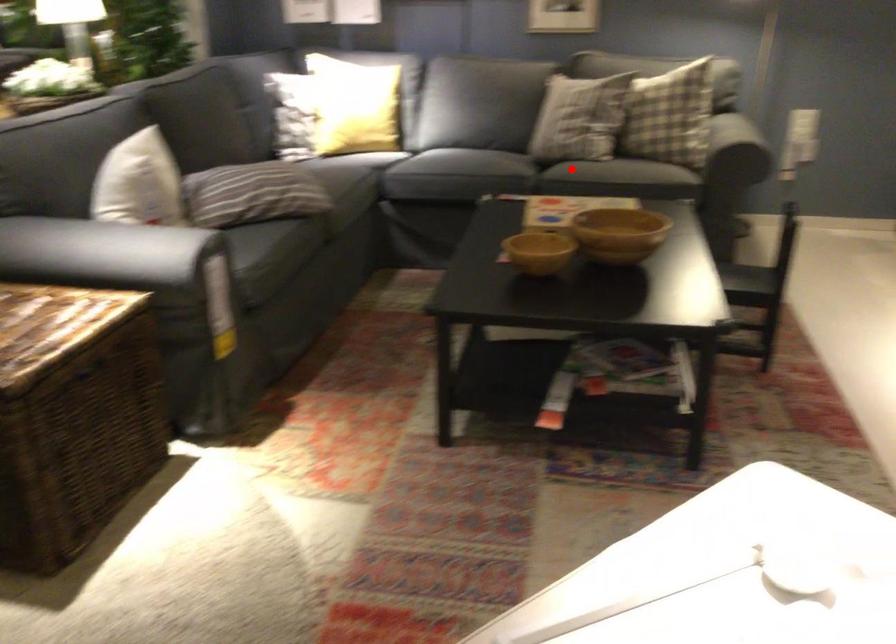
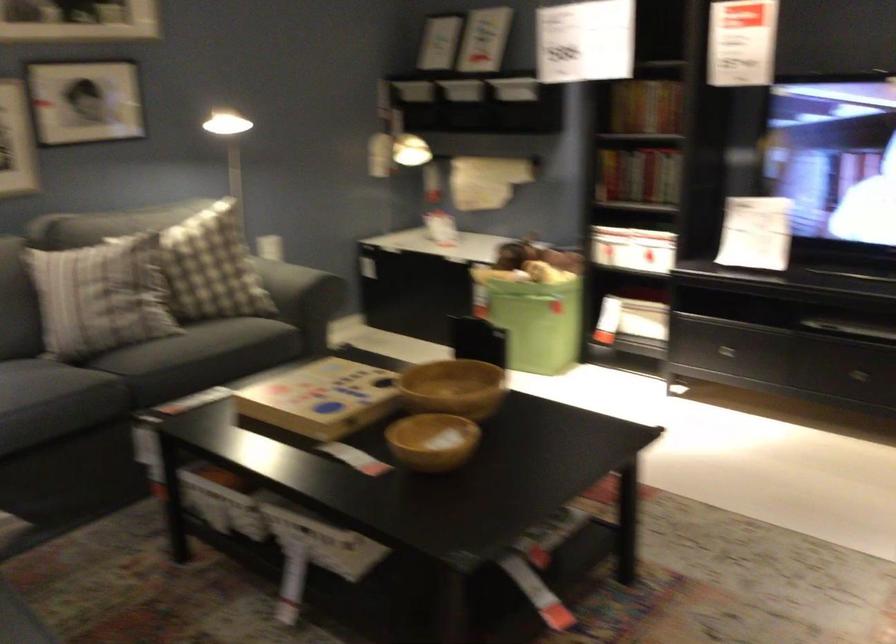
Question: I am providing you with two images of the same scene from different viewpoints. A red point is shown in image1. For the corresponding object point in image2, is it positioned nearer or farther from the camera?

Choices:
 (A) Nearer
 (B) Farther

Answer: (A)